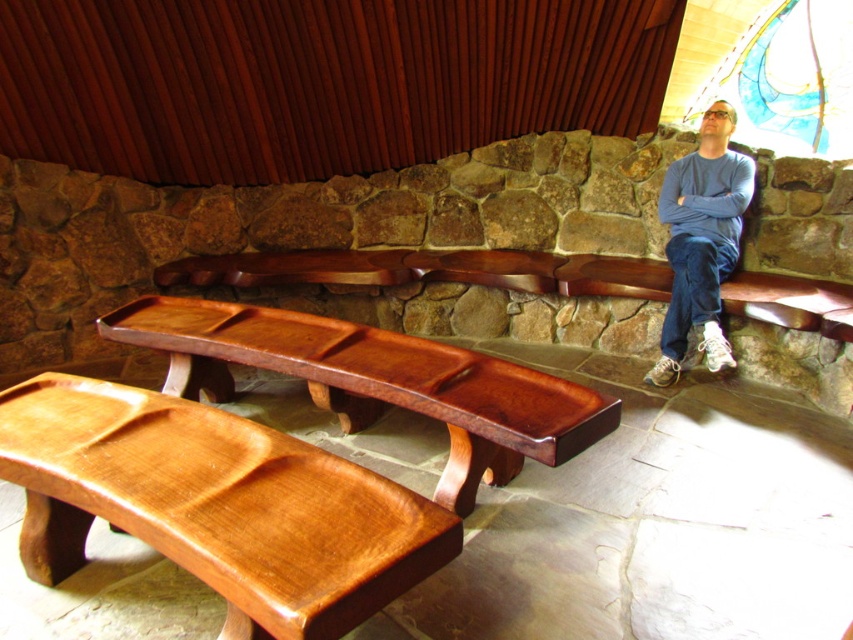
Question: Does shiny brown wood bench at lower left appear on the left side of satin wood bench at center?

Choices:
 (A) yes
 (B) no

Answer: (A)

Question: Can you confirm if satin wood bench at center is positioned above blue cotton shirt at right?

Choices:
 (A) no
 (B) yes

Answer: (A)

Question: Can you confirm if shiny brown wood bench at lower left is positioned to the left of satin wood bench at center?

Choices:
 (A) yes
 (B) no

Answer: (A)

Question: Which of the following is the farthest from the observer?

Choices:
 (A) satin wood bench at center
 (B) shiny brown wood bench at lower left

Answer: (A)

Question: Which object is closer to the camera taking this photo?

Choices:
 (A) shiny brown wood bench at lower left
 (B) satin wood bench at center

Answer: (A)

Question: Which object is the closest to the satin wood bench at center?

Choices:
 (A) blue cotton shirt at right
 (B) shiny brown wood bench at lower left

Answer: (B)